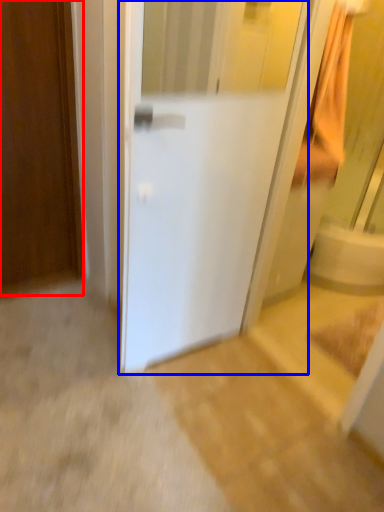
Question: Among these objects, which one is farthest to the camera, door (highlighted by a red box) or door (highlighted by a blue box)?

Choices:
 (A) door
 (B) door

Answer: (A)